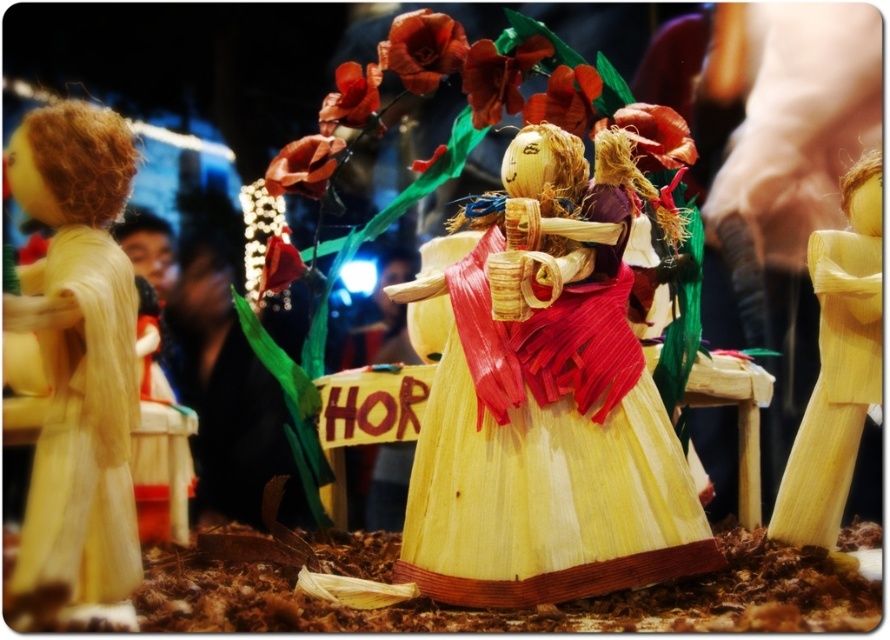
You are an artist planning to create a new corn husk doll that needs to be taller than both the natural straw dress at center and the matte yellow corn husk doll at left. Based on the scene description, what is the minimum height your new doll should be?

The natural straw dress at center is not as tall as the matte yellow corn husk doll at left, so the new doll must be taller than the matte yellow corn husk doll at left to satisfy both conditions.

You are standing 40 inches away from a display of corn husk dolls. There is a point marked at coordinates point (664, 444). Can you reach this point with your hand if you extend it fully?

The distance of point (664, 444) from viewer is 37.78 inches, which is less than the 40 inches you are standing away. Since your fully extended hand can reach up to 40 inches, you can reach the point.

You are an artist planning to display two dolls side by side in a gallery. The matte yellow corn husk doll at left and the natural straw doll at right. Given their sizes, which doll will require more horizontal space for proper display?

The matte yellow corn husk doll at left requires more horizontal space because its width is larger than the natural straw doll at right.